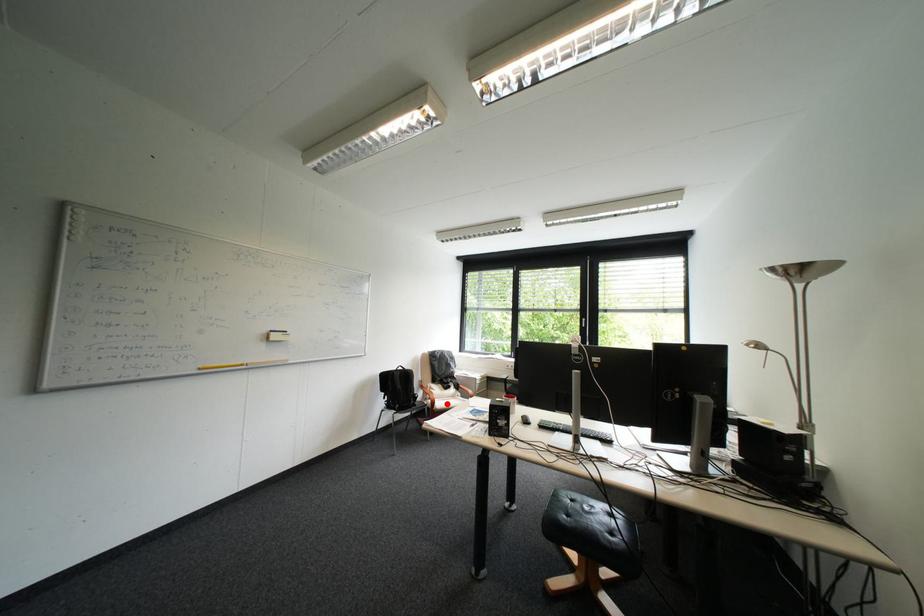
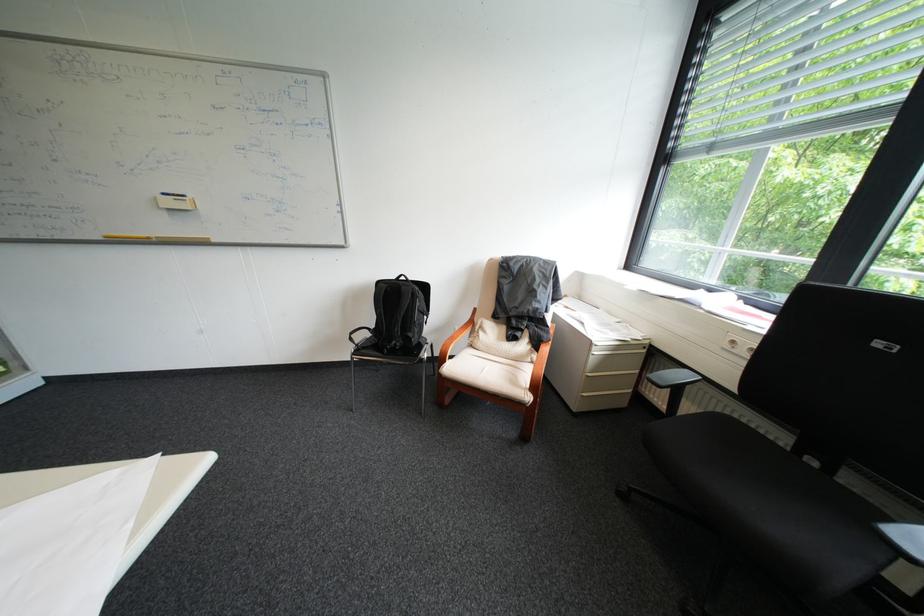
The point at the highlighted location is marked in the first image. Where is the corresponding point in the second image?

(456, 363)